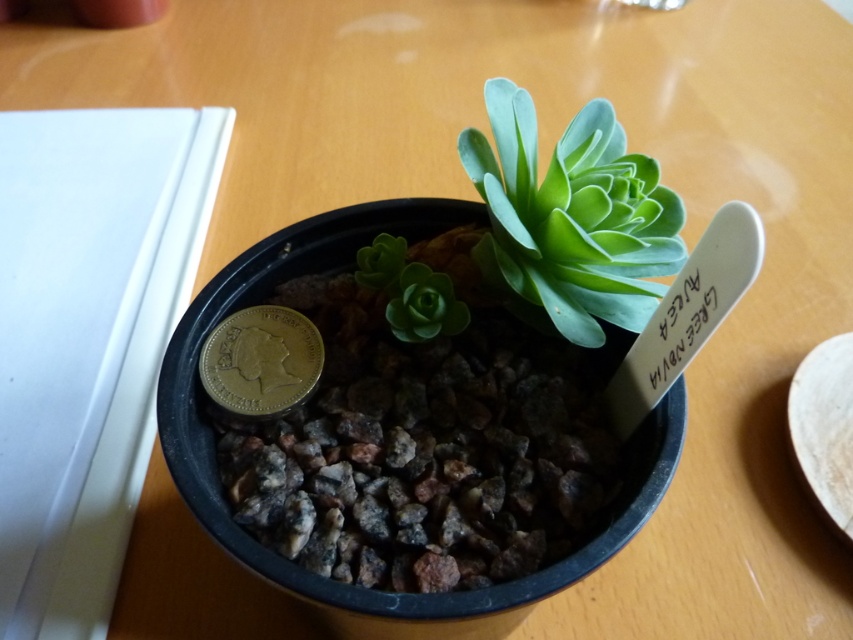
Can you confirm if green succulent at center is wider than gold plated coin at center?

Correct, the width of green succulent at center exceeds that of gold plated coin at center.

Consider the image. Who is more forward, (511, 106) or (207, 346)?

Point (511, 106) is in front.

Is point (508, 180) farther from viewer compared to point (283, 396)?

No, it is in front of (283, 396).

Find the location of a particular element. green succulent at center is located at coordinates (572, 218).